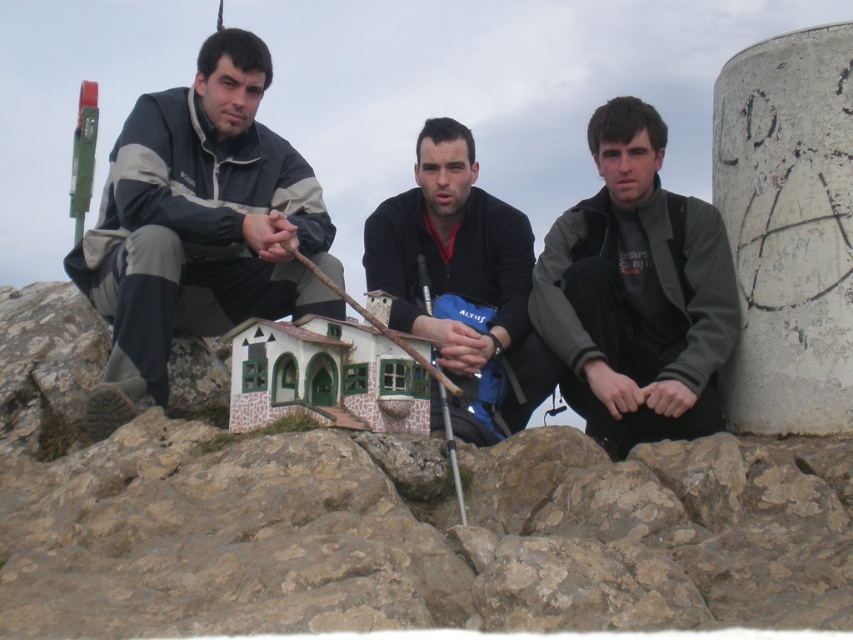
Question: Which of these objects is positioned farthest from the black matte shirt at center?

Choices:
 (A) white concrete pillar at upper right
 (B) matte gray jacket at left
 (C) dark gray jacket at center

Answer: (A)

Question: Does matte gray jacket at left appear on the right side of black matte shirt at center?

Choices:
 (A) yes
 (B) no

Answer: (B)

Question: Which object appears farthest from the camera in this image?

Choices:
 (A) white concrete pillar at upper right
 (B) matte gray jacket at left

Answer: (B)

Question: Can you confirm if matte gray jacket at left is smaller than black matte shirt at center?

Choices:
 (A) yes
 (B) no

Answer: (B)

Question: Does white concrete pillar at upper right have a larger size compared to dark gray jacket at center?

Choices:
 (A) yes
 (B) no

Answer: (B)

Question: Among these objects, which one is nearest to the camera?

Choices:
 (A) black matte shirt at center
 (B) dark gray jacket at center
 (C) white concrete pillar at upper right
 (D) matte gray jacket at left

Answer: (C)